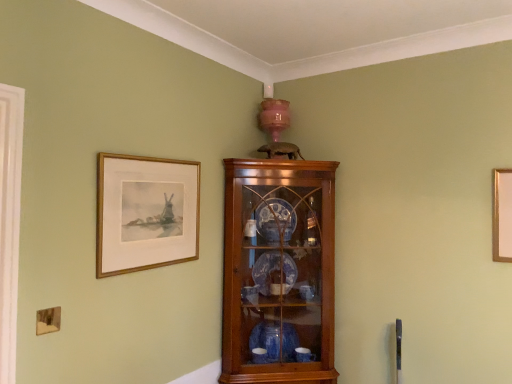
Question: Is wooden framed print at upper left completely or partially outside of wooden cabinet at upper center?

Choices:
 (A) no
 (B) yes

Answer: (B)

Question: Is wooden framed print at upper left to the left of wooden cabinet at upper center from the viewer's perspective?

Choices:
 (A) no
 (B) yes

Answer: (B)

Question: Is wooden framed print at upper left smaller than wooden cabinet at upper center?

Choices:
 (A) no
 (B) yes

Answer: (B)

Question: Is wooden framed print at upper left at the right side of wooden cabinet at upper center?

Choices:
 (A) yes
 (B) no

Answer: (B)

Question: Would you say wooden cabinet at upper center is part of wooden framed print at upper left's contents?

Choices:
 (A) yes
 (B) no

Answer: (B)

Question: From the image's perspective, is wooden framed print at upper left on top of wooden cabinet at upper center?

Choices:
 (A) yes
 (B) no

Answer: (A)

Question: Is wooden cabinet at upper center turned away from wooden framed print at upper left?

Choices:
 (A) yes
 (B) no

Answer: (B)

Question: Are wooden cabinet at upper center and wooden framed print at upper left beside each other?

Choices:
 (A) no
 (B) yes

Answer: (A)

Question: From a real-world perspective, is wooden cabinet at upper center positioned under wooden framed print at upper left based on gravity?

Choices:
 (A) yes
 (B) no

Answer: (A)

Question: Is wooden cabinet at upper center smaller than wooden framed print at upper left?

Choices:
 (A) yes
 (B) no

Answer: (B)

Question: Is wooden cabinet at upper center wider than wooden framed print at upper left?

Choices:
 (A) no
 (B) yes

Answer: (B)

Question: Is wooden cabinet at upper center behind wooden framed print at upper left?

Choices:
 (A) no
 (B) yes

Answer: (B)

Question: Based on their sizes in the image, would you say wooden cabinet at upper center is bigger or smaller than wooden framed print at upper left?

Choices:
 (A) big
 (B) small

Answer: (A)